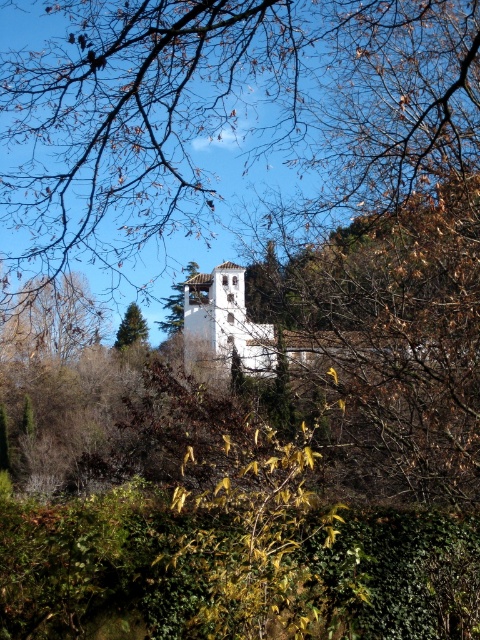
Can you confirm if brown leafy tree at center is wider than white stucco bell tower at center?

No.

Is brown leafy tree at center in front of white stucco bell tower at center?

Yes, it is in front of white stucco bell tower at center.

Image resolution: width=480 pixels, height=640 pixels. What do you see at coordinates (228, 109) in the screenshot?
I see `brown leafy tree at center` at bounding box center [228, 109].

Image resolution: width=480 pixels, height=640 pixels. What are the coordinates of `brown leafy tree at center` in the screenshot? It's located at (228, 109).

Is brown leafy tree at center further to camera compared to green textured pine tree at center?

No.

Does brown leafy tree at center appear on the left side of green textured pine tree at center?

No, brown leafy tree at center is not to the left of green textured pine tree at center.

Between point (113, 227) and point (137, 326), which one is positioned in front?

Positioned in front is point (113, 227).

Identify the location of brown leafy tree at center. (228, 109).

Between point (204, 282) and point (140, 321), which one is positioned behind?

The point (140, 321) is behind.

Is white stucco bell tower at center positioned in front of green textured pine tree at center?

Yes.

The image size is (480, 640). Find the location of `white stucco bell tower at center`. white stucco bell tower at center is located at coordinates [223, 324].

I want to click on white stucco bell tower at center, so click(x=223, y=324).